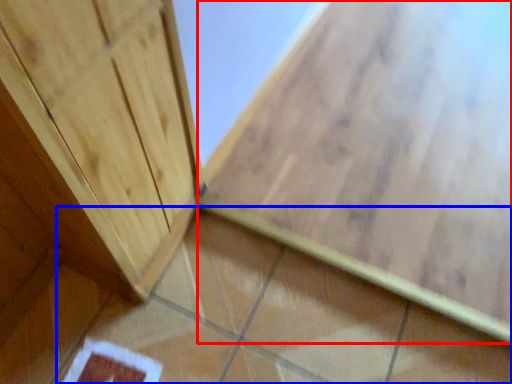
Question: Which object appears closest to the camera in this image, ceramic tile (highlighted by a red box) or ceramic tile (highlighted by a blue box)?

Choices:
 (A) ceramic tile
 (B) ceramic tile

Answer: (B)